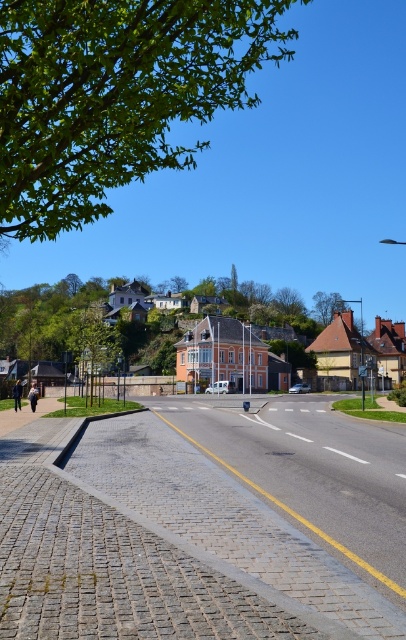
Who is lower down, green plastic street sign at center or metallic rectangular sign at center-right?

green plastic street sign at center

Is green plastic street sign at center taller than metallic rectangular sign at center-right?

Correct, green plastic street sign at center is much taller as metallic rectangular sign at center-right.

Does point (362, 362) come farther from viewer compared to point (362, 371)?

Yes, it is behind point (362, 371).

The height and width of the screenshot is (640, 406). I want to click on green plastic street sign at center, so click(362, 381).

Is green leafy tree at upper center behind green plastic street sign at center?

Yes, green leafy tree at upper center is behind green plastic street sign at center.

Between point (334, 300) and point (362, 385), which one is positioned behind?

Point (334, 300)

Locate an element on the screen. Image resolution: width=406 pixels, height=640 pixels. green leafy tree at upper center is located at coordinates (x=326, y=305).

Where is `green leafy tree at upper center`? green leafy tree at upper center is located at coordinates (326, 305).

Is green leafy tree at upper left to the left of green leafy tree at upper center from the viewer's perspective?

Correct, you'll find green leafy tree at upper left to the left of green leafy tree at upper center.

Does green leafy tree at upper left appear over green leafy tree at upper center?

Yes.

Does point (194, 1) come closer to viewer compared to point (332, 298)?

Yes.

Find the location of a particular element. This screenshot has height=640, width=406. green leafy tree at upper left is located at coordinates (114, 93).